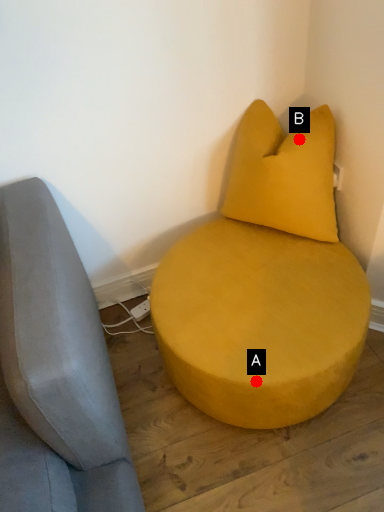
Question: Two points are circled on the image, labeled by A and B beside each circle. Which point is closer to the camera?

Choices:
 (A) A is closer
 (B) B is closer

Answer: (A)